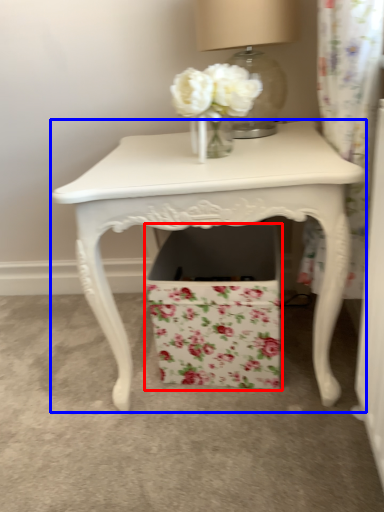
Question: Which of the following is the closest to the observer, cardboard box (highlighted by a red box) or table (highlighted by a blue box)?

Choices:
 (A) cardboard box
 (B) table

Answer: (B)